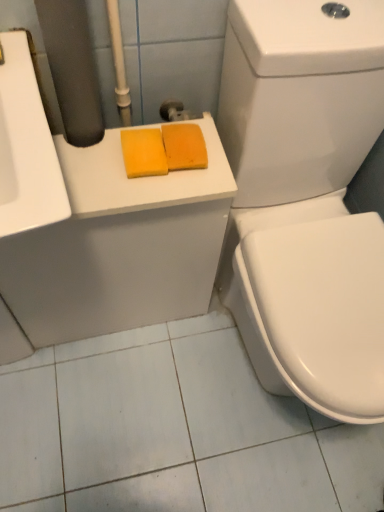
Question: Based on their sizes in the image, would you say yellow sponge at upper left is bigger or smaller than white glossy toilet at right?

Choices:
 (A) small
 (B) big

Answer: (A)

Question: In terms of height, does yellow sponge at upper left look taller or shorter compared to white glossy toilet at right?

Choices:
 (A) tall
 (B) short

Answer: (B)

Question: Estimate the real-world distances between objects in this image. Which object is farther from the white glossy toilet at right?

Choices:
 (A) orange sponge at upper center, which appears as the first soap when viewed from the right
 (B) yellow sponge at upper left
 (C) yellow sponge at center, the 2th soap in the right-to-left sequence

Answer: (C)

Question: Based on their relative distances, which object is farther from the yellow sponge at center, the 2th soap in the right-to-left sequence?

Choices:
 (A) white glossy toilet at right
 (B) yellow sponge at upper left
 (C) orange sponge at upper center, acting as the second soap starting from the left

Answer: (A)